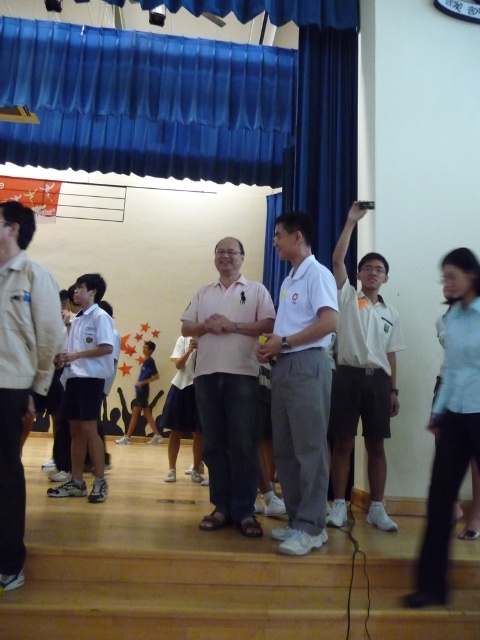
From the picture: You are standing in the auditorium and want to take a photo of the point at coordinates (177, 172). The camera you are using has a maximum focus range of 7 meters. Will the camera be able to focus on the point?

The point at coordinates (177, 172) is 6.87 meters away from the camera. Since the maximum focus range is 7 meters, the camera can focus on the point as it is within the range.

You are organizing a photo shoot and need to ensure that the two individuals in the image are positioned so that their clothing items are clearly visible. Given that the pink fabric shirt at center and the white matte uniform at center have different sizes, which clothing item might require more space to accommodate its size?

The pink fabric shirt at center has a larger size compared to the white matte uniform at center, so it would require more space to accommodate its size.

You are a photographer standing at the back of the hall. You need to take a photo of both the pink fabric shirt at center and the white matte uniform at center. Which one is closer to the camera?

The pink fabric shirt at center is positioned under the white matte uniform at center, so the white matte uniform at center is closer to the camera.